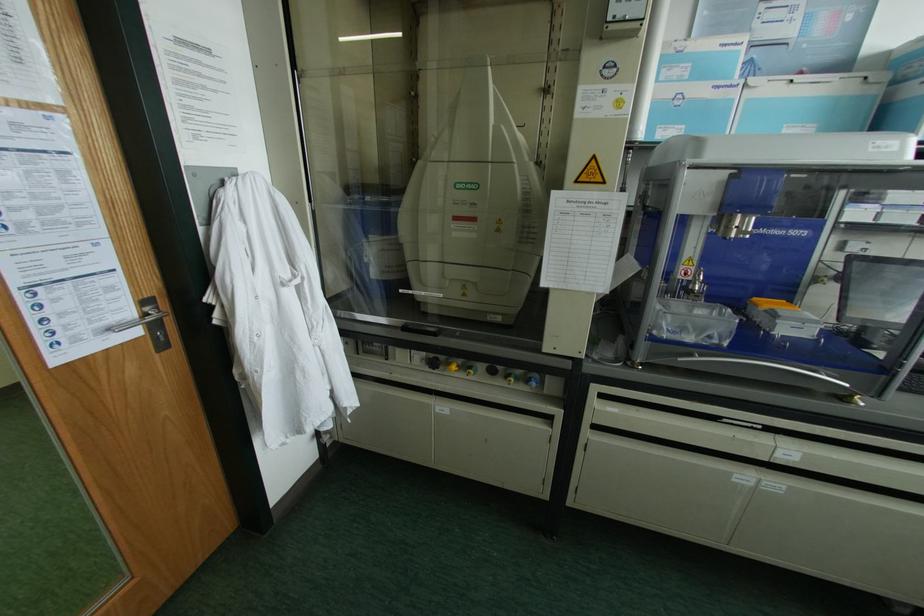
At what (x,y) coordinates should I click in order to perform the action: click on metal door handle. Please return your answer as a coordinate pair (x, y). The width and height of the screenshot is (924, 616). Looking at the image, I should click on (140, 315).